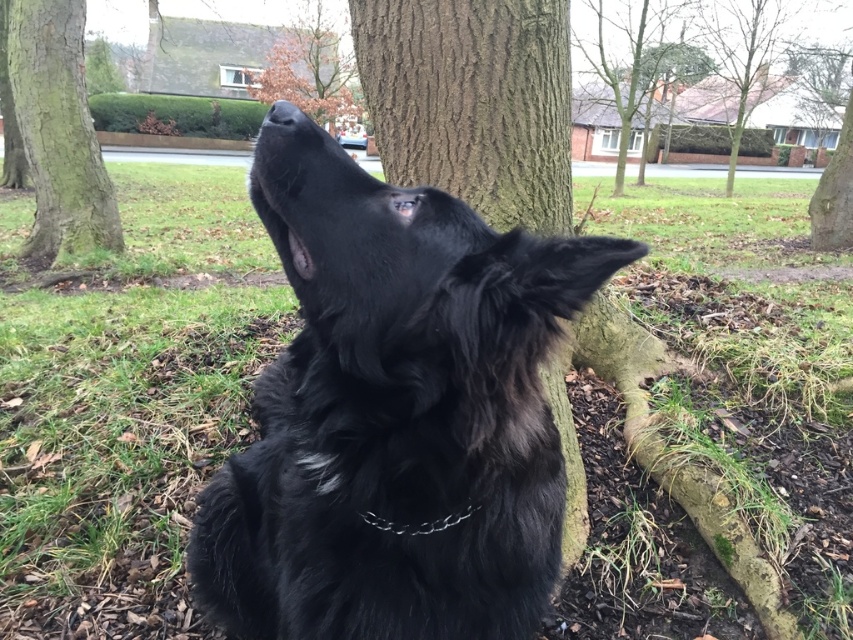
Question: Does smooth brown bark at center lie behind green rough bark tree at left?

Choices:
 (A) no
 (B) yes

Answer: (A)

Question: Can you confirm if brown rough tree trunk at center is bigger than green rough bark tree at left?

Choices:
 (A) no
 (B) yes

Answer: (A)

Question: Which object is positioned farthest from the green rough bark tree at left?

Choices:
 (A) metallic chain at center
 (B) black furry dog at center

Answer: (A)

Question: Which point is farther to the camera?

Choices:
 (A) brown textured tree at upper center
 (B) black furry dog at center
 (C) brown rough tree trunk at upper center
 (D) brown rough tree trunk at center

Answer: (A)

Question: Is brown rough tree trunk at center to the right of metallic chain at center from the viewer's perspective?

Choices:
 (A) no
 (B) yes

Answer: (B)

Question: Among these points, which one is farthest from the camera?

Choices:
 (A) (370, 522)
 (B) (76, 108)
 (C) (608, 364)

Answer: (B)